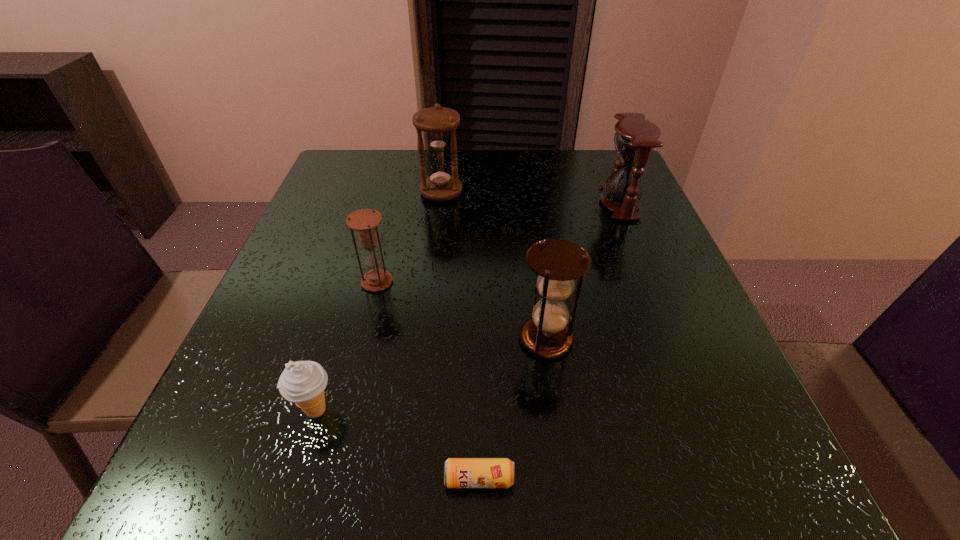
Image resolution: width=960 pixels, height=540 pixels. Find the location of `the third hourglass from right to left`. the third hourglass from right to left is located at coordinates (439, 123).

You are a GUI agent. You are given a task and a screenshot of the screen. Output one action in this format:
    pyautogui.click(x=<x>, y=<y>)
    Task: Click on the rightmost object
    
    Given the screenshot: What is the action you would take?
    pyautogui.click(x=635, y=138)

Locate an element on the screen. the fourth farthest object is located at coordinates (557, 263).

Where is `the nearest hourglass`? the nearest hourglass is located at coordinates (557, 263).

The image size is (960, 540). In order to click on the second nearest hourglass in this screenshot , I will do `click(364, 221)`.

The height and width of the screenshot is (540, 960). In order to click on the shortest hourglass in this screenshot , I will do `click(364, 221)`.

This screenshot has height=540, width=960. Identify the location of the second nearest object. (302, 382).

Find the location of a particular element. This screenshot has height=540, width=960. icecream is located at coordinates (302, 382).

Find the location of `the nearest object`. the nearest object is located at coordinates (458, 472).

The width and height of the screenshot is (960, 540). In order to click on the shortest object in this screenshot , I will do `click(458, 472)`.